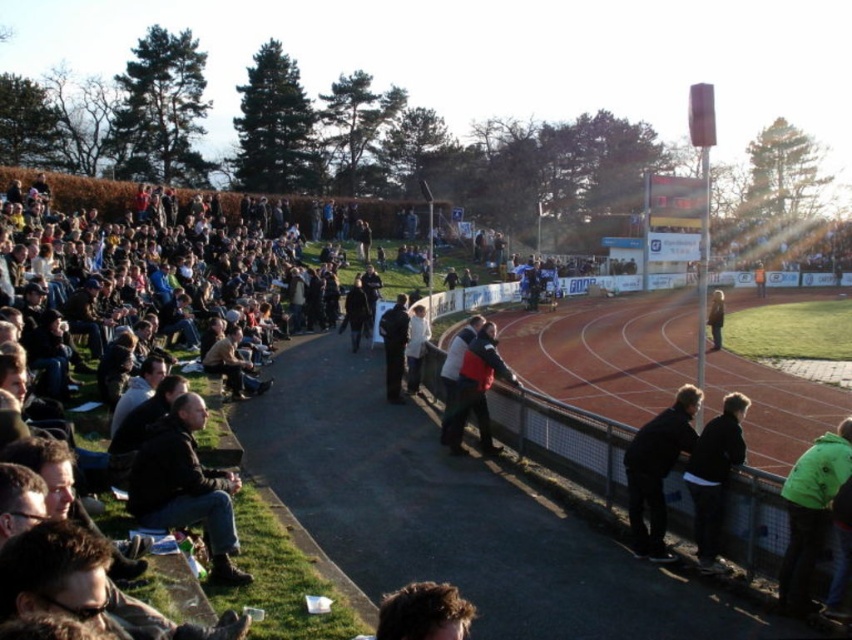
Question: Which of the following is the farthest from the observer?

Choices:
 (A) dark gray jacket at center
 (B) red jacket at center

Answer: (A)

Question: Is black matte jacket at lower right above white cotton jacket at center?

Choices:
 (A) no
 (B) yes

Answer: (A)

Question: Which point is farther from the camera taking this photo?

Choices:
 (A) (343, 330)
 (B) (802, 483)
 (C) (721, 321)
 (D) (711, 499)

Answer: (C)

Question: Does smooth red track at center have a larger size compared to dark blue jacket at lower right?

Choices:
 (A) no
 (B) yes

Answer: (B)

Question: Is dark brown leather jacket at lower left positioned behind green fleece jacket at lower right?

Choices:
 (A) yes
 (B) no

Answer: (B)

Question: Which object is the farthest from the black matte jacket at lower right?

Choices:
 (A) dark gray jacket at center
 (B) green fleece jacket at lower right
 (C) brown leather jacket at center

Answer: (C)